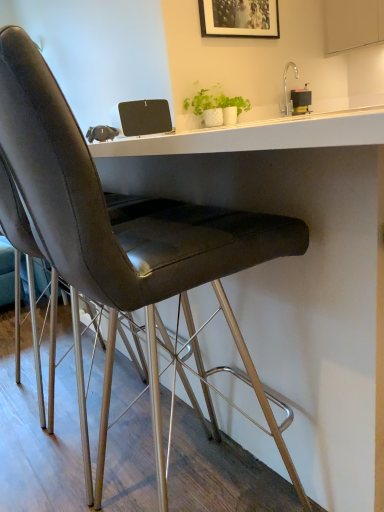
Question: Would you say wooden picture frame at upper center is outside white matte cabinet at upper right?

Choices:
 (A) no
 (B) yes

Answer: (B)

Question: Can you confirm if wooden picture frame at upper center is taller than white matte cabinet at upper right?

Choices:
 (A) yes
 (B) no

Answer: (B)

Question: Considering the relative sizes of wooden picture frame at upper center and white matte cabinet at upper right in the image provided, is wooden picture frame at upper center thinner than white matte cabinet at upper right?

Choices:
 (A) yes
 (B) no

Answer: (A)

Question: From the image's perspective, is wooden picture frame at upper center beneath white matte cabinet at upper right?

Choices:
 (A) no
 (B) yes

Answer: (B)

Question: Can white matte cabinet at upper right be found inside wooden picture frame at upper center?

Choices:
 (A) no
 (B) yes

Answer: (A)

Question: Can you confirm if wooden picture frame at upper center is wider than white matte cabinet at upper right?

Choices:
 (A) no
 (B) yes

Answer: (A)

Question: Could you tell me if white matte cabinet at upper right is turned towards wooden picture frame at upper center?

Choices:
 (A) yes
 (B) no

Answer: (A)

Question: Is white matte cabinet at upper right wider than wooden picture frame at upper center?

Choices:
 (A) no
 (B) yes

Answer: (B)

Question: Does white matte cabinet at upper right come behind wooden picture frame at upper center?

Choices:
 (A) no
 (B) yes

Answer: (B)

Question: From a real-world perspective, does white matte cabinet at upper right stand above wooden picture frame at upper center?

Choices:
 (A) yes
 (B) no

Answer: (B)

Question: Is white matte cabinet at upper right shorter than wooden picture frame at upper center?

Choices:
 (A) no
 (B) yes

Answer: (A)

Question: Does white matte cabinet at upper right contain wooden picture frame at upper center?

Choices:
 (A) no
 (B) yes

Answer: (A)

Question: Is wooden picture frame at upper center taller or shorter than white matte cabinet at upper right?

Choices:
 (A) short
 (B) tall

Answer: (A)